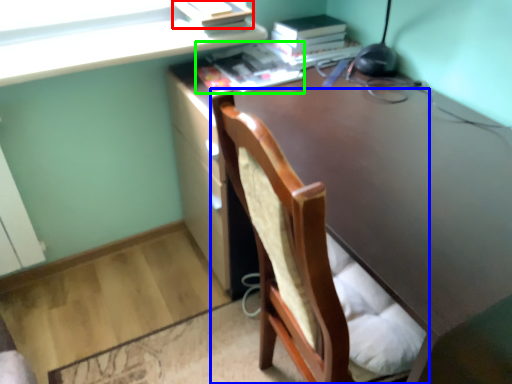
Question: Which object is the farthest from paperback book (highlighted by a red box)? Choose among these: chair (highlighted by a blue box) or book (highlighted by a green box).

Choices:
 (A) chair
 (B) book

Answer: (A)